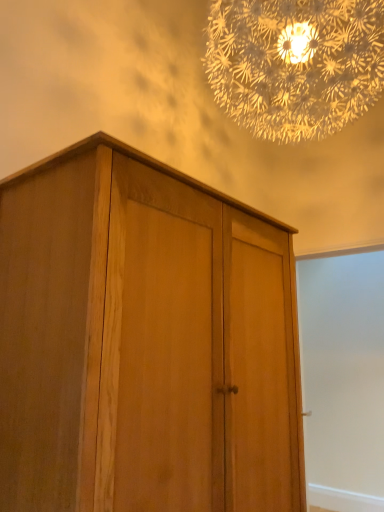
This screenshot has height=512, width=384. In order to click on translucent glass chandelier at upper center in this screenshot , I will do `click(295, 64)`.

What do you see at coordinates (343, 379) in the screenshot? I see `white matte screen door at right` at bounding box center [343, 379].

Identify the location of translucent glass chandelier at upper center. (295, 64).

Which point is more distant from viewer, (x=294, y=140) or (x=335, y=458)?

Positioned behind is point (x=335, y=458).

Is translucent glass chandelier at upper center facing towards white matte screen door at right?

No.

From the picture: Can you confirm if translucent glass chandelier at upper center is smaller than white matte screen door at right?

No, translucent glass chandelier at upper center is not smaller than white matte screen door at right.

This screenshot has width=384, height=512. In order to click on lamp located in front of the white matte screen door at right in this screenshot , I will do `click(295, 64)`.

Which is more to the left, white matte screen door at right or translucent glass chandelier at upper center?

translucent glass chandelier at upper center.

Which is in front, white matte screen door at right or translucent glass chandelier at upper center?

translucent glass chandelier at upper center.

Can you confirm if white matte screen door at right is smaller than translucent glass chandelier at upper center?

Indeed, white matte screen door at right has a smaller size compared to translucent glass chandelier at upper center.

Considering the sizes of natural wood cupboard at center and translucent glass chandelier at upper center in the image, is natural wood cupboard at center wider or thinner than translucent glass chandelier at upper center?

natural wood cupboard at center is thinner than translucent glass chandelier at upper center.

Which of these two, natural wood cupboard at center or translucent glass chandelier at upper center, is smaller?

natural wood cupboard at center.

Does natural wood cupboard at center turn towards translucent glass chandelier at upper center?

No.

Which is behind, point (214, 350) or point (240, 97)?

The point (240, 97) is farther.

What's the angular difference between translucent glass chandelier at upper center and natural wood cupboard at center's facing directions?

The angular difference between translucent glass chandelier at upper center and natural wood cupboard at center is 90 degrees.

Is translucent glass chandelier at upper center positioned before natural wood cupboard at center?

That is False.

From a real-world perspective, is translucent glass chandelier at upper center above or below natural wood cupboard at center?

translucent glass chandelier at upper center is situated higher than natural wood cupboard at center in the real world.

Considering the positions of point (63, 399) and point (377, 294), is point (63, 399) closer or farther from the camera than point (377, 294)?

Point (63, 399) is closer to the camera than point (377, 294).

In the scene shown: Which object is wider, natural wood cupboard at center or white matte screen door at right?

natural wood cupboard at center is wider.

Could you tell me if natural wood cupboard at center is turned towards white matte screen door at right?

No, natural wood cupboard at center does not turn towards white matte screen door at right.

From a real-world perspective, between natural wood cupboard at center and white matte screen door at right, who is vertically higher?

From a 3D spatial view, natural wood cupboard at center is above.

Does white matte screen door at right lie behind natural wood cupboard at center?

That is True.

Locate an element on the screen. cupboard above the white matte screen door at right (from the image's perspective) is located at coordinates (144, 342).

In terms of height, does white matte screen door at right look taller or shorter compared to natural wood cupboard at center?

Considering their sizes, white matte screen door at right has more height than natural wood cupboard at center.

Is white matte screen door at right inside or outside of natural wood cupboard at center?

white matte screen door at right lies outside natural wood cupboard at center.

Image resolution: width=384 pixels, height=512 pixels. Find the location of `screen door below the translucent glass chandelier at upper center (from the image's perspective)`. screen door below the translucent glass chandelier at upper center (from the image's perspective) is located at coordinates (343, 379).

The width and height of the screenshot is (384, 512). I want to click on screen door below the translucent glass chandelier at upper center (from a real-world perspective), so click(343, 379).

From the image, which object appears to be farther from white matte screen door at right, natural wood cupboard at center or translucent glass chandelier at upper center?

Based on the image, natural wood cupboard at center appears to be further to white matte screen door at right.

Looking at this image, which object lies further to the anchor point natural wood cupboard at center, translucent glass chandelier at upper center or white matte screen door at right?

Among the two, white matte screen door at right is located further to natural wood cupboard at center.

Considering their positions, is natural wood cupboard at center positioned further to translucent glass chandelier at upper center than white matte screen door at right?

white matte screen door at right is positioned further to the anchor translucent glass chandelier at upper center.

Looking at the image, which one is located closer to natural wood cupboard at center, white matte screen door at right or translucent glass chandelier at upper center?

Based on the image, translucent glass chandelier at upper center appears to be nearer to natural wood cupboard at center.

Consider the image. Based on their spatial positions, is white matte screen door at right or natural wood cupboard at center closer to translucent glass chandelier at upper center?

natural wood cupboard at center.

Which object lies nearer to the anchor point white matte screen door at right, translucent glass chandelier at upper center or natural wood cupboard at center?

The object closer to white matte screen door at right is translucent glass chandelier at upper center.

Locate an element on the screen. cupboard between translucent glass chandelier at upper center and white matte screen door at right vertically is located at coordinates tap(144, 342).